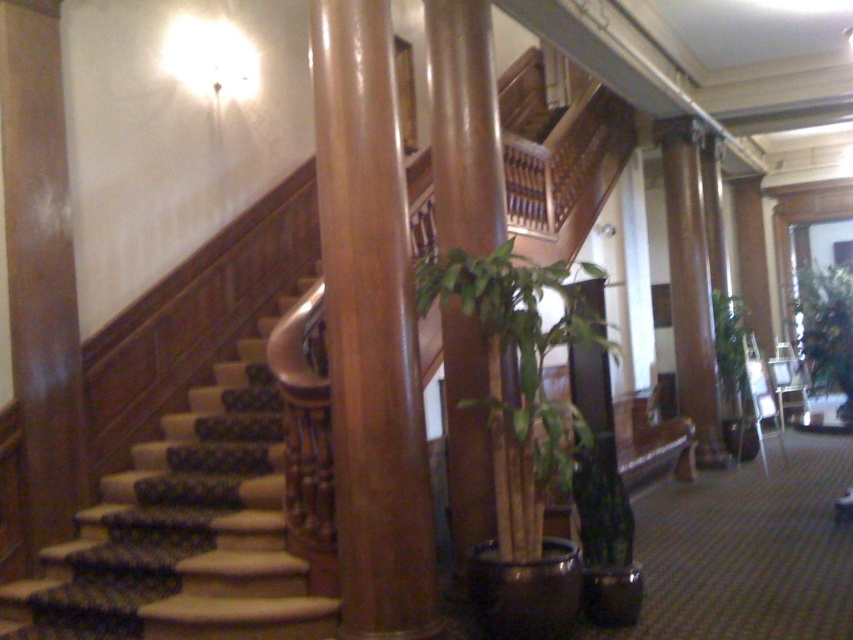
Based on the photo, you are a gardener who needs to move a new potted plant to the space between the two columns near the staircase. The new plant has a width of 1.5 meters. Can you determine if the space between the green leafy plant at center and the green leafy plant at right is wide enough to accommodate the new plant?

The distance between the green leafy plant at center and the green leafy plant at right is 7.01 meters. Since the new plant is only 1.5 meters wide, there is sufficient space to place it between them.